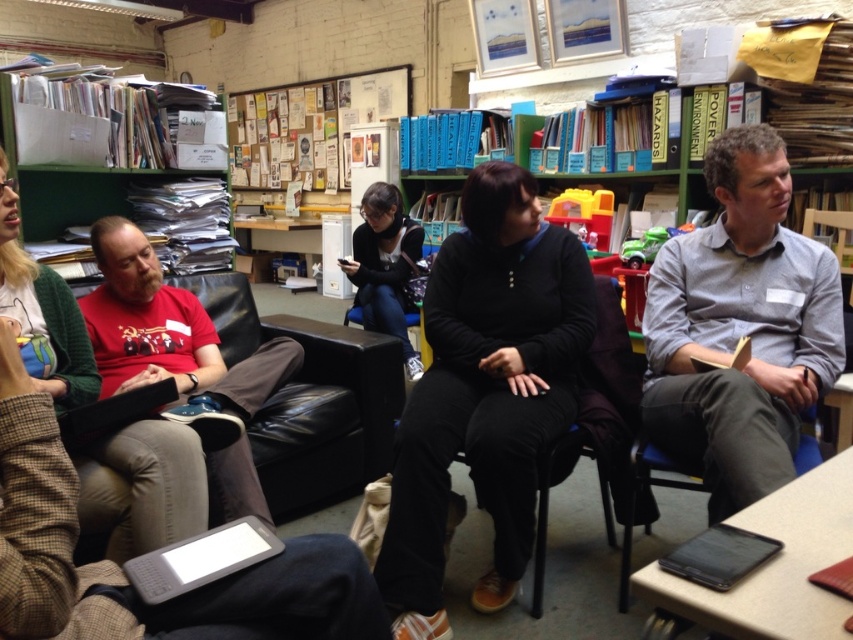
Who is positioned more to the left, black matte sweater at center or black fabric jacket at center?

Positioned to the left is black fabric jacket at center.

Which is behind, point (531, 349) or point (407, 268)?

Point (407, 268)

Locate an element on the screen. black matte sweater at center is located at coordinates (485, 392).

Who is lower down, black matte sweater at center or gray cotton shirt at center?

black matte sweater at center

Describe the element at coordinates (485, 392) in the screenshot. I see `black matte sweater at center` at that location.

At what (x,y) coordinates should I click in order to perform the action: click on black matte sweater at center. Please return your answer as a coordinate pair (x, y). The image size is (853, 640). Looking at the image, I should click on (485, 392).

You are a GUI agent. You are given a task and a screenshot of the screen. Output one action in this format:
    pyautogui.click(x=<x>, y=<y>)
    Task: Click on the black matte sweater at center
    
    Given the screenshot: What is the action you would take?
    pyautogui.click(x=485, y=392)

This screenshot has height=640, width=853. Identify the location of black matte sweater at center. (485, 392).

This screenshot has width=853, height=640. What are the coordinates of `black matte sweater at center` in the screenshot? It's located at (485, 392).